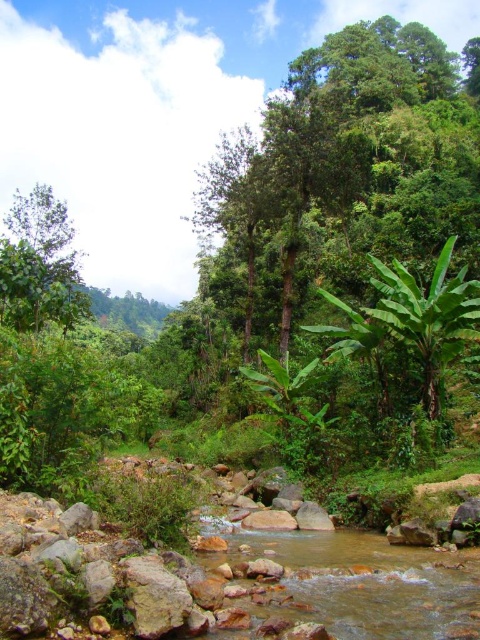
You are an ecologist studying the forest structure. You observe the green leafy tree at center and the green leafy tree at left. Which tree would cast a larger shadow during midday when the sun is directly overhead?

The green leafy tree at center is taller than the green leafy tree at left, so it would cast a larger shadow during midday when the sun is directly overhead because taller objects generally cast larger shadows under similar lighting conditions.

You are a hiker carrying a 20 meter long rope. You want to use it to cross the stream between the green leafy tree at center and the green leafy tree at left. Can the rope reach both trees to make a bridge?

The distance between the green leafy tree at center and the green leafy tree at left is 57.77 meters, so the 20 meter rope is too short to span the gap between them. You would need a longer rope to create a bridge between the two trees.